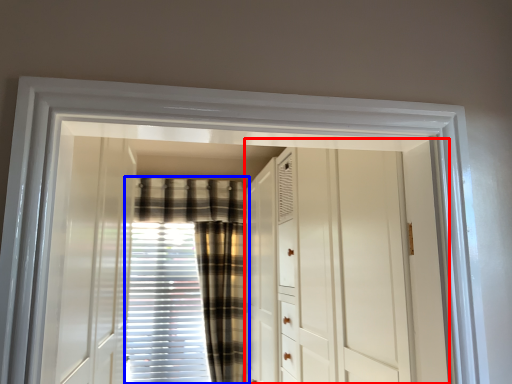
Question: Which object appears closest to the camera in this image, dresser (highlighted by a red box) or curtain (highlighted by a blue box)?

Choices:
 (A) dresser
 (B) curtain

Answer: (A)